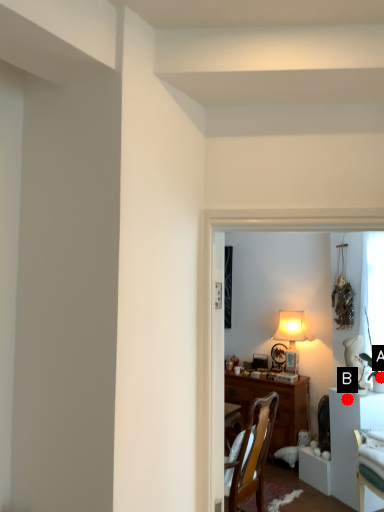
Question: Two points are circled on the image, labeled by A and B beside each circle. Which point is closer to the camera?

Choices:
 (A) A is closer
 (B) B is closer

Answer: (A)